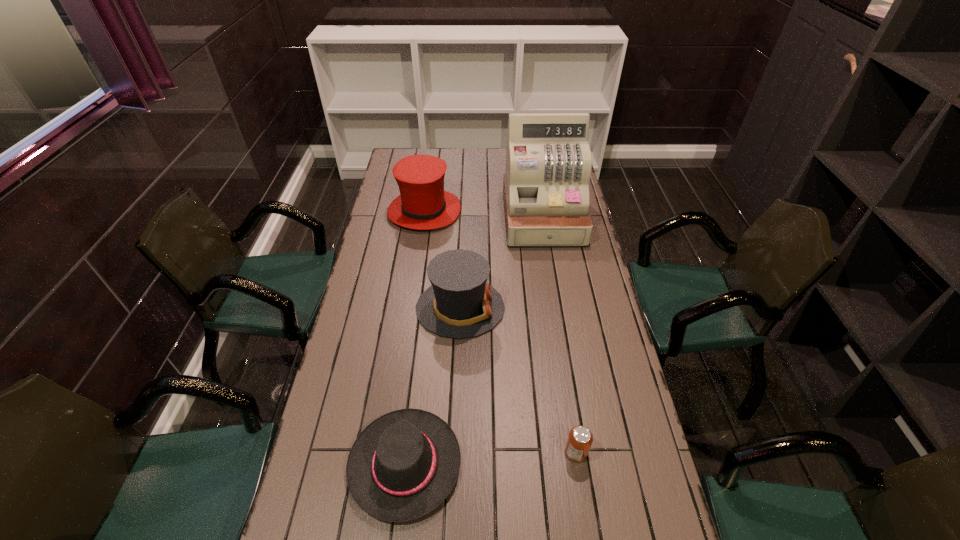
Find the location of `the tallest object`. the tallest object is located at coordinates click(548, 160).

This screenshot has height=540, width=960. What are the coordinates of `the farthest dress hat` in the screenshot? It's located at (423, 204).

Locate an element on the screen. The image size is (960, 540). the second tallest dress hat is located at coordinates (459, 304).

Where is `the third nearest object`? The width and height of the screenshot is (960, 540). the third nearest object is located at coordinates (459, 304).

Locate an element on the screen. The height and width of the screenshot is (540, 960). the nearest dress hat is located at coordinates (404, 464).

Find the location of `can`. can is located at coordinates (580, 438).

You are a GUI agent. You are given a task and a screenshot of the screen. Output one action in this format:
    pyautogui.click(x=<x>, y=<y>)
    Task: Click on the free space located on the operating side of the cash register
    This screenshot has width=960, height=540.
    Given the screenshot: What is the action you would take?
    pyautogui.click(x=558, y=307)

Locate an element on the screen. vacant point located on the back of the farthest dress hat is located at coordinates (433, 155).

At what (x,y) coordinates should I click in order to perform the action: click on vacant region located 0.160m with goggles on the front of the second farthest dress hat. Please return your answer as a coordinate pair (x, y). Looking at the image, I should click on (551, 308).

I want to click on free region located on the right of the nearest dress hat, so click(611, 464).